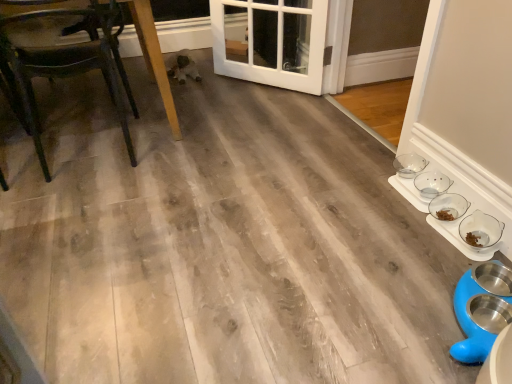
Find the location of a particular element. The image size is (512, 384). vacant position to the left of clear glass bowl at lower right, the 3th bowl in the back-to-front sequence is located at coordinates (410, 220).